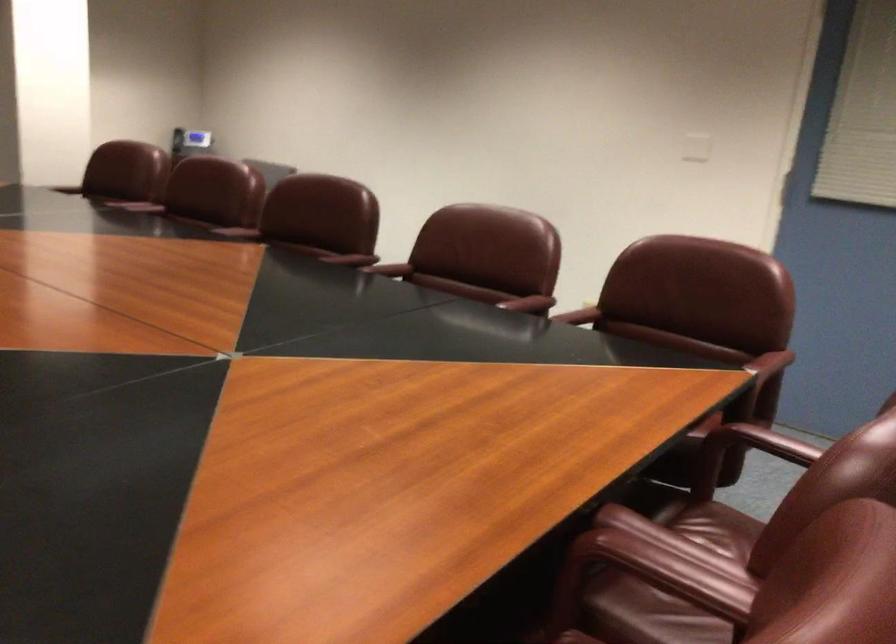
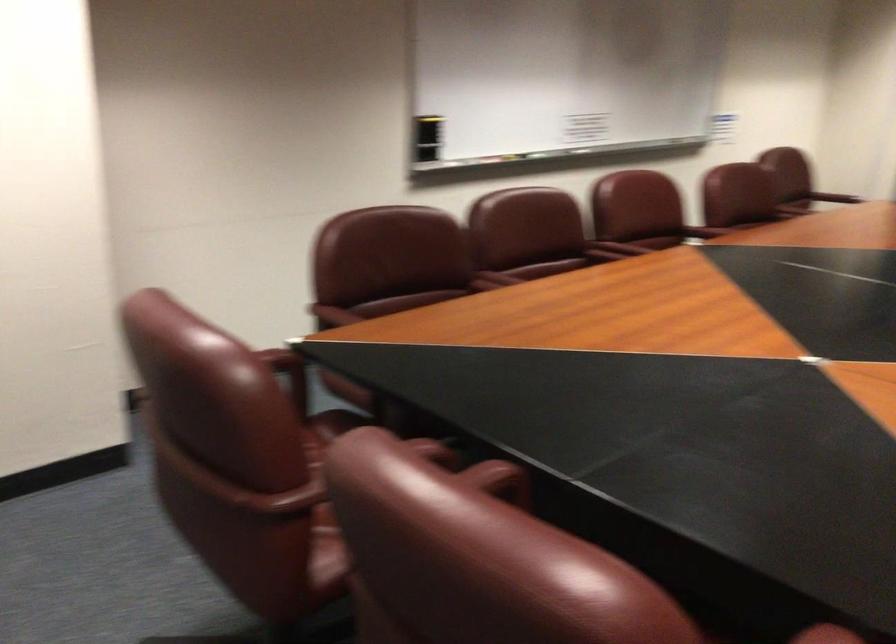
Find the pixel in the second image that matches pixel 768 391 in the first image.

(289, 374)